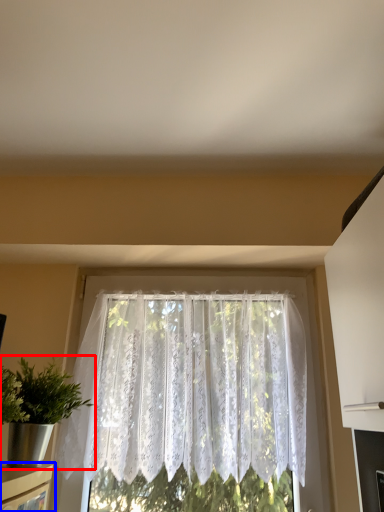
Question: Which of the following is the farthest to the observer, houseplant (highlighted by a red box) or shelf (highlighted by a blue box)?

Choices:
 (A) houseplant
 (B) shelf

Answer: (A)